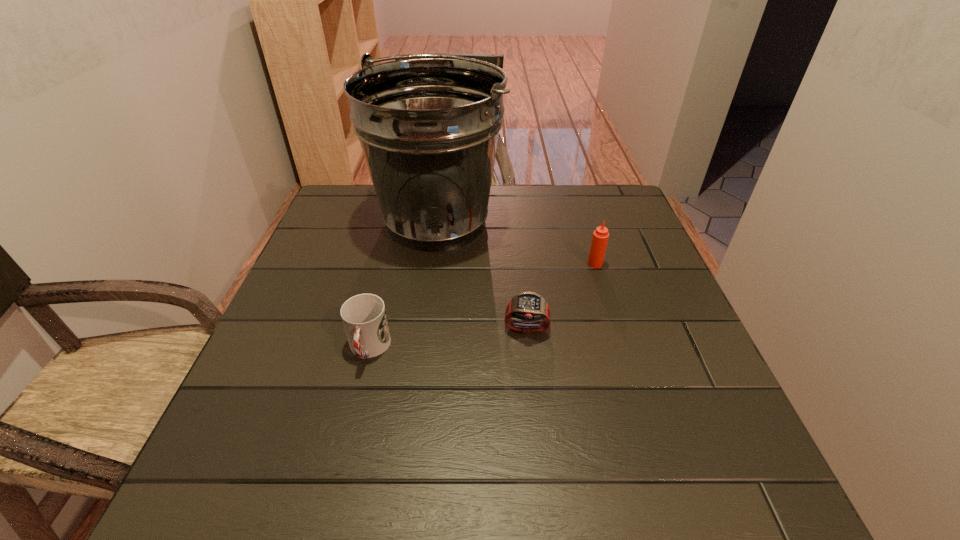
In order to click on object that is at the left edge in this screenshot , I will do `click(428, 127)`.

Locate an element on the screen. The image size is (960, 540). object positioned at the right edge is located at coordinates [x=600, y=237].

Locate an element on the screen. This screenshot has height=540, width=960. object that is at the far left corner is located at coordinates (428, 127).

The image size is (960, 540). I want to click on vacant space at the left edge of the desktop, so click(305, 289).

Locate an element on the screen. Image resolution: width=960 pixels, height=540 pixels. vacant area at the right edge is located at coordinates (610, 273).

This screenshot has height=540, width=960. What are the coordinates of `vacant space at the far left corner of the desktop` in the screenshot? It's located at (366, 213).

In the image, there is a desktop. Find the location of `vacant space at the near left corner`. vacant space at the near left corner is located at coordinates (268, 462).

Find the location of `vacant space at the far right corner of the desktop`. vacant space at the far right corner of the desktop is located at coordinates (597, 227).

Locate an element on the screen. Image resolution: width=960 pixels, height=540 pixels. empty space between the tallest object and the second tallest object is located at coordinates (516, 243).

You are a GUI agent. You are given a task and a screenshot of the screen. Output one action in this format:
    pyautogui.click(x=<x>, y=<y>)
    Task: Click on the vacant region between the shortest object and the rightmost object
    This screenshot has width=960, height=540.
    Given the screenshot: What is the action you would take?
    pyautogui.click(x=561, y=296)